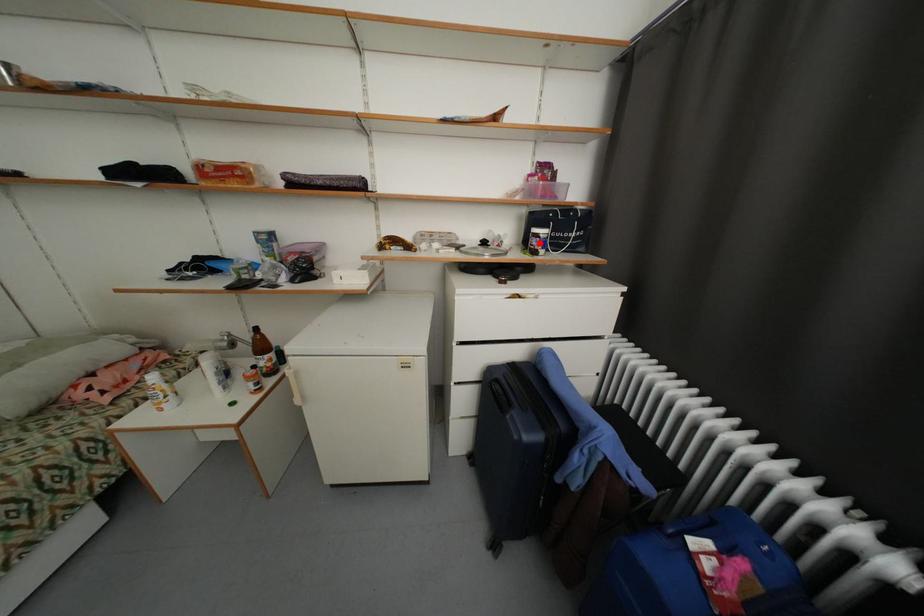
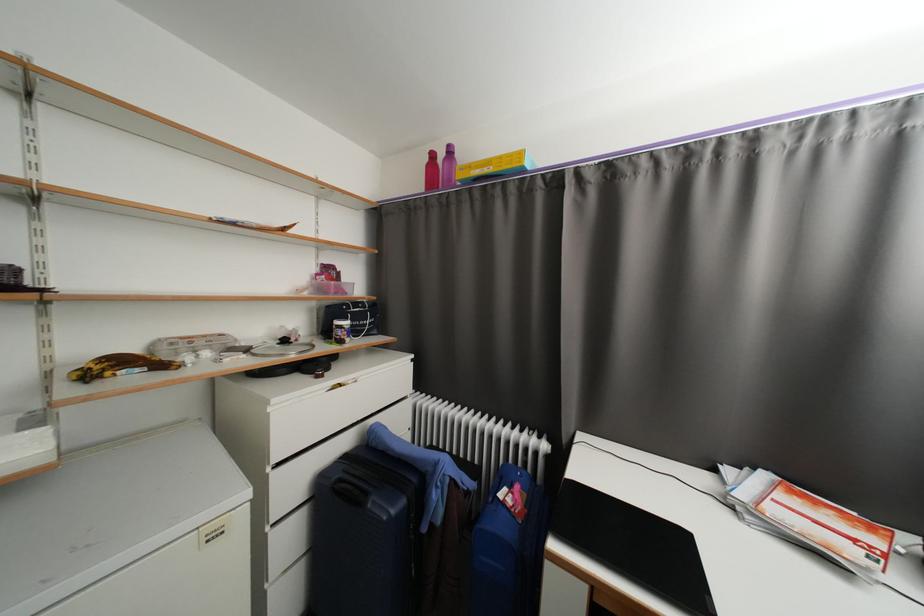
Locate, in the second image, the point that corresponds to the highlighted location in the first image.

(346, 334)